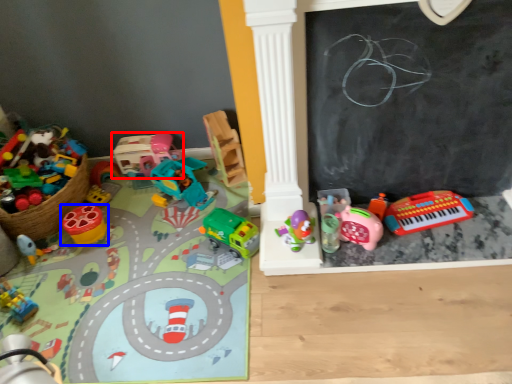
Question: Which object is further to the camera taking this photo, toy (highlighted by a red box) or toy (highlighted by a blue box)?

Choices:
 (A) toy
 (B) toy

Answer: (A)